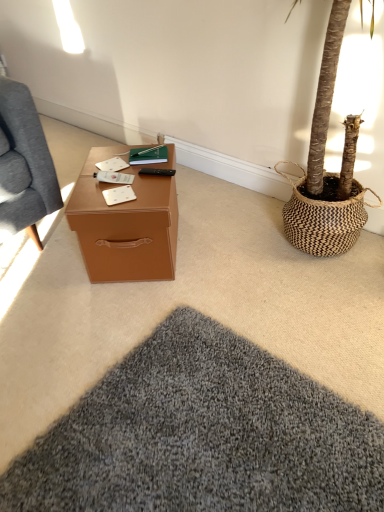
Where is `vacant area that is in front of brown leather desk at center`? This screenshot has height=512, width=384. vacant area that is in front of brown leather desk at center is located at coordinates (123, 323).